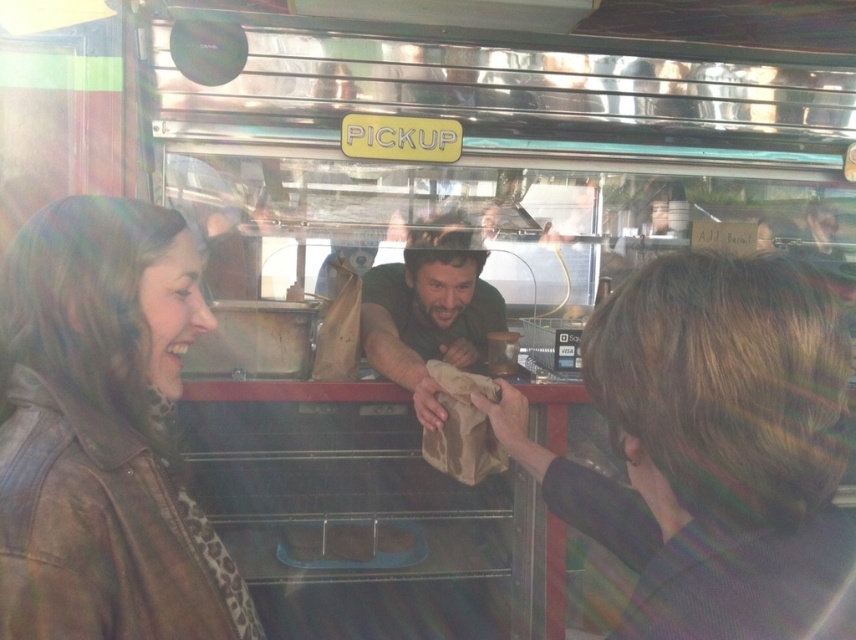
You are a customer at the food truck and want to grab the brown paper bag at center. Can you reach it without moving your position?

→ The brown paper bag at center is 28.28 inches from viewer, so yes, you can reach it without moving your position since it is within arm reach.

You are taking a photo of the food truck scene. You want to focus on the point at point (780, 289) and point (479, 266). Which point is closer to your camera?

Point (780, 289) is closer to the camera than point (479, 266).

You are a customer at the food truck and want to know if the brown paper bag at center can fit inside your pocket. The green fabric shirt at center is already in your pocket. Based on their sizes, is this possible?

The brown paper bag at center is thinner than the green fabric shirt at center, so it might fit inside your pocket if the shirt is already there, but this depends on the pocket size.